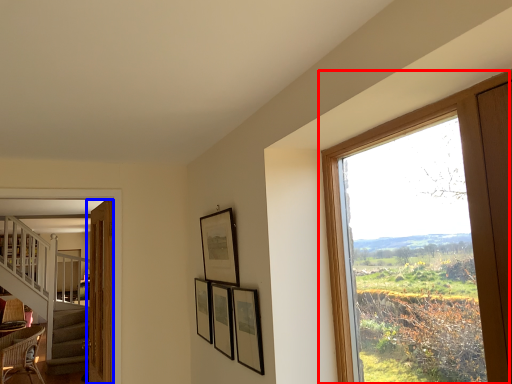
Question: Among these objects, which one is farthest to the camera, window (highlighted by a red box) or door (highlighted by a blue box)?

Choices:
 (A) window
 (B) door

Answer: (B)